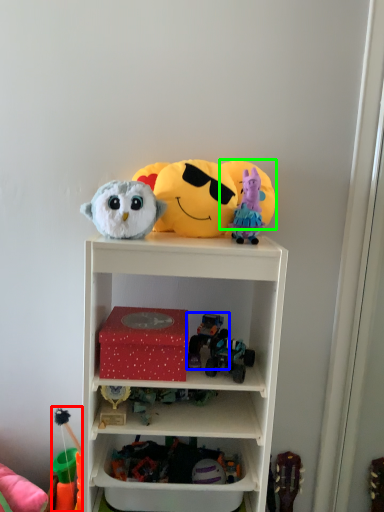
Question: Considering the real-world distances, which object is farthest from toy (highlighted by a red box)? toy (highlighted by a blue box) or toy (highlighted by a green box)?

Choices:
 (A) toy
 (B) toy

Answer: (B)